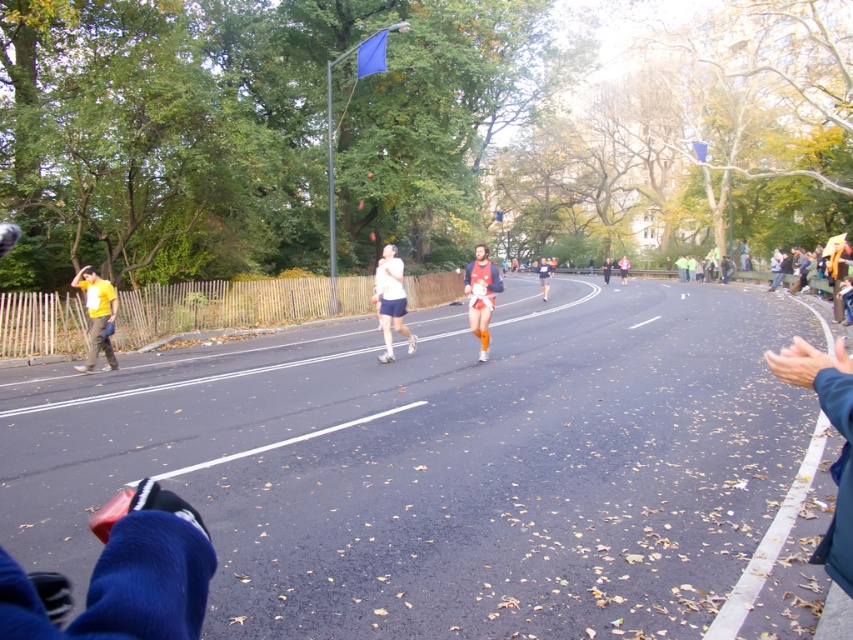
Who is shorter, yellow matte shirt at left or orange athletic wear at center?

With less height is yellow matte shirt at left.

Between point (86, 305) and point (546, 266), which one is positioned in front?

Positioned in front is point (86, 305).

Between point (82, 289) and point (548, 268), which one is positioned in front?

Positioned in front is point (82, 289).

You are a GUI agent. You are given a task and a screenshot of the screen. Output one action in this format:
    pyautogui.click(x=<x>, y=<y>)
    Task: Click on the yellow matte shirt at left
    
    Given the screenshot: What is the action you would take?
    pyautogui.click(x=96, y=314)

Is white running shoes at center wider than orange fabric runner at center?

Yes, white running shoes at center is wider than orange fabric runner at center.

This screenshot has height=640, width=853. I want to click on white running shoes at center, so click(x=440, y=465).

Is point (386, 300) closer to camera compared to point (483, 292)?

No, it is not.

The image size is (853, 640). Describe the element at coordinates (392, 300) in the screenshot. I see `white matte shorts at center` at that location.

The width and height of the screenshot is (853, 640). Identify the location of white matte shorts at center. (392, 300).